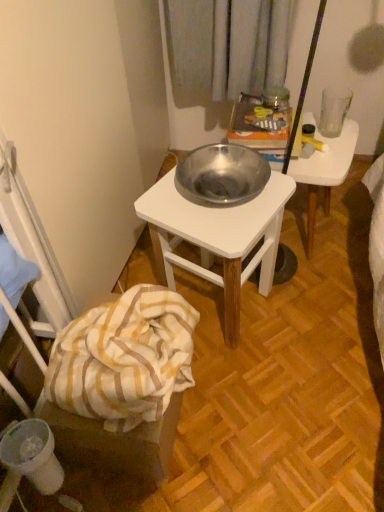
This screenshot has width=384, height=512. Identify the location of vacant space in front of transparent glass at upper right. (331, 156).